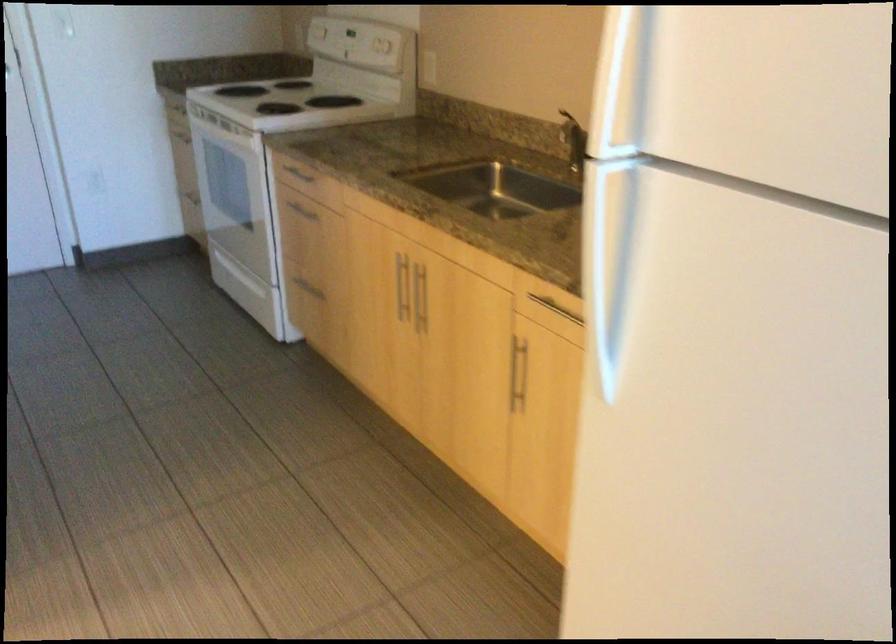
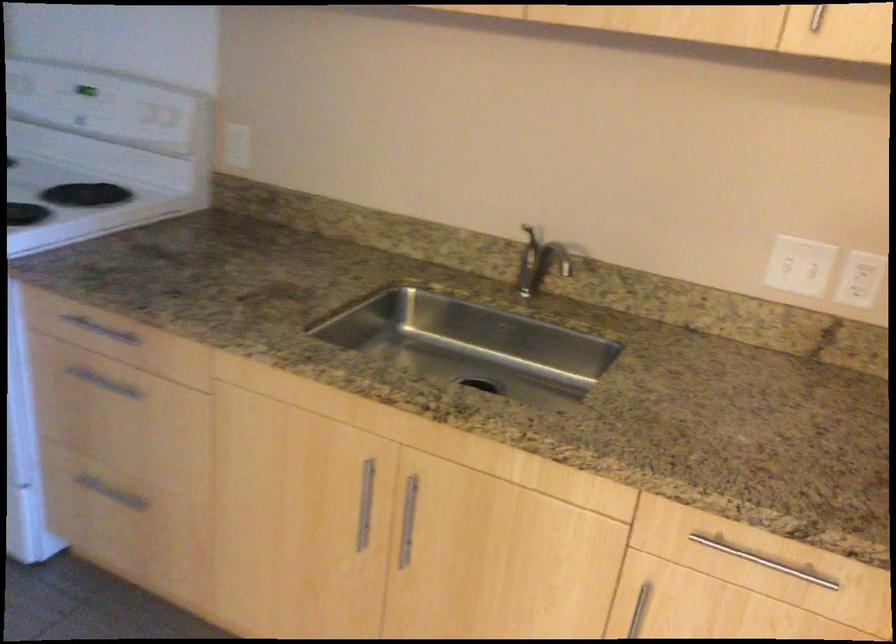
Find the pixel in the second image that matches point 420,301 in the first image.

(408, 520)